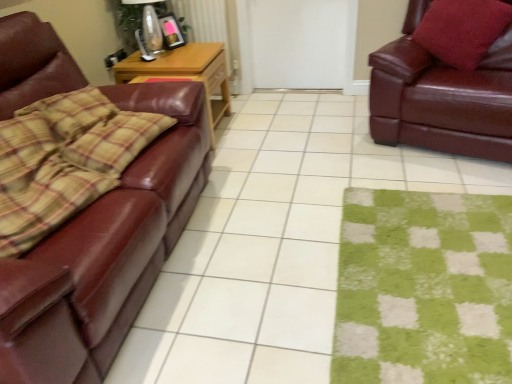
Where is `free space in front of white matte door at center`? This screenshot has height=384, width=512. free space in front of white matte door at center is located at coordinates (296, 110).